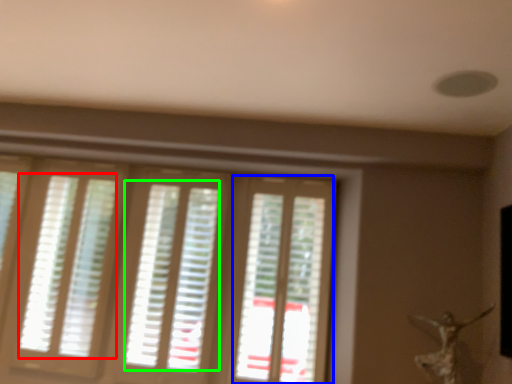
Question: Estimate the real-world distances between objects in this image. Which object is farther from blind (highlighted by a red box), screen door (highlighted by a blue box) or blind (highlighted by a green box)?

Choices:
 (A) screen door
 (B) blind

Answer: (A)